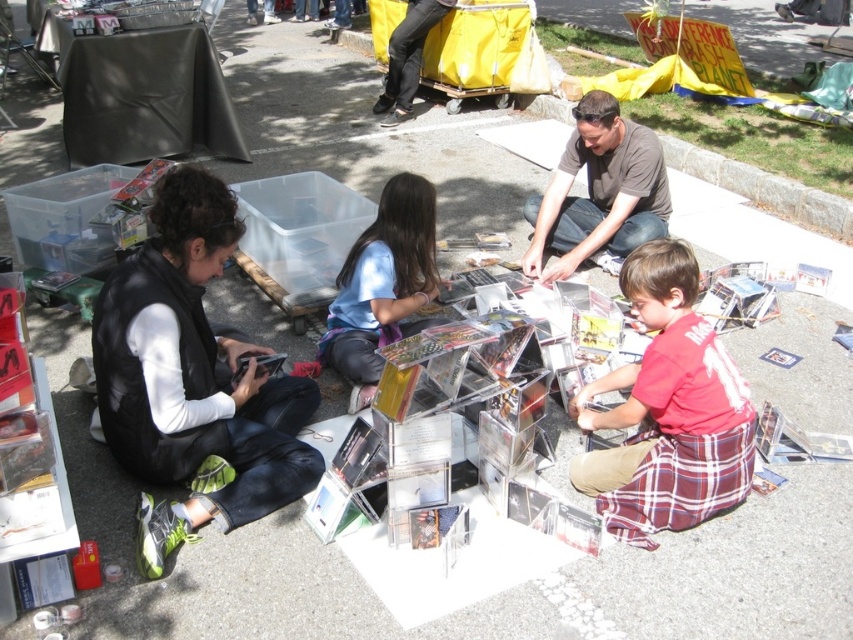
You are standing in the middle of the scene and want to greet the person in the blue matte shirt at center without moving past the person in the matte brown shirt at center. Is this possible?

The blue matte shirt at center is behind the matte brown shirt at center, so you cannot greet the person in the blue matte shirt at center without moving past the person in the matte brown shirt at center.

What is located at the coordinates point (668,410) in the image?

The point (668,410) marks the location of the red plaid shorts at lower right.